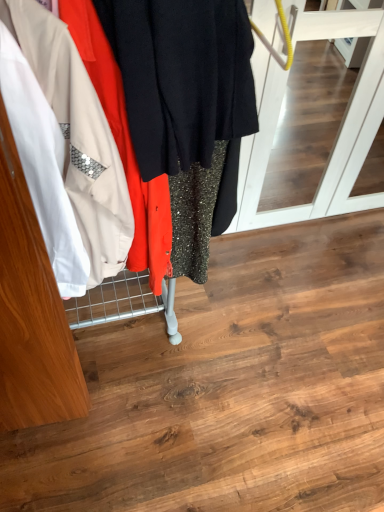
Question: Does matte black screen door at center have a greater height compared to metallic sequined dress at left?

Choices:
 (A) yes
 (B) no

Answer: (B)

Question: Is matte black screen door at center next to metallic sequined dress at left?

Choices:
 (A) no
 (B) yes

Answer: (A)

Question: Considering the relative sizes of matte black screen door at center and metallic sequined dress at left in the image provided, is matte black screen door at center thinner than metallic sequined dress at left?

Choices:
 (A) no
 (B) yes

Answer: (A)

Question: From a real-world perspective, is matte black screen door at center beneath metallic sequined dress at left?

Choices:
 (A) yes
 (B) no

Answer: (A)

Question: Is matte black screen door at center not inside metallic sequined dress at left?

Choices:
 (A) yes
 (B) no

Answer: (A)

Question: Considering the relative sizes of matte black screen door at center and metallic sequined dress at left in the image provided, is matte black screen door at center wider than metallic sequined dress at left?

Choices:
 (A) no
 (B) yes

Answer: (B)

Question: Would you say matte black screen door at center is part of metallic sequined dress at left's contents?

Choices:
 (A) yes
 (B) no

Answer: (B)

Question: Can you confirm if metallic sequined dress at left is bigger than matte black screen door at center?

Choices:
 (A) no
 (B) yes

Answer: (A)

Question: Is metallic sequined dress at left oriented away from matte black screen door at center?

Choices:
 (A) no
 (B) yes

Answer: (A)

Question: Is metallic sequined dress at left completely or partially outside of matte black screen door at center?

Choices:
 (A) yes
 (B) no

Answer: (A)

Question: From the image's perspective, does metallic sequined dress at left appear lower than matte black screen door at center?

Choices:
 (A) yes
 (B) no

Answer: (A)

Question: From the image's perspective, is metallic sequined dress at left above matte black screen door at center?

Choices:
 (A) no
 (B) yes

Answer: (A)

Question: Choose the correct answer: Is matte black screen door at center inside metallic sequined dress at left or outside it?

Choices:
 (A) inside
 (B) outside

Answer: (B)